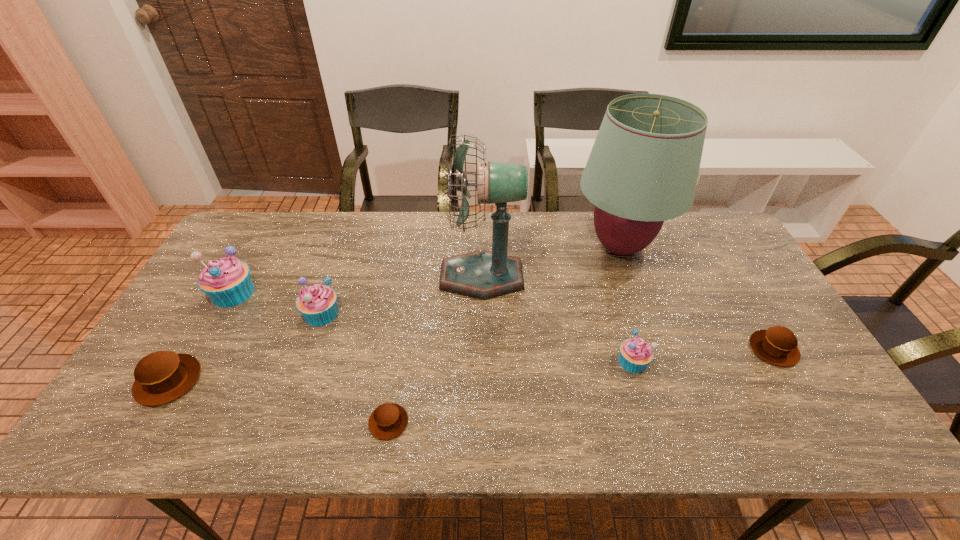
Find the location of `free spot at the right edge of the desktop`. free spot at the right edge of the desktop is located at coordinates (752, 351).

Locate an element on the screen. Image resolution: width=960 pixels, height=540 pixels. vacant space at the far left corner of the desktop is located at coordinates (280, 231).

You are a GUI agent. You are given a task and a screenshot of the screen. Output one action in this format:
    pyautogui.click(x=<x>, y=<y>)
    Task: Click on the vacant space at the far right corner of the desktop
    This screenshot has height=540, width=960.
    Given the screenshot: What is the action you would take?
    pyautogui.click(x=681, y=225)

The height and width of the screenshot is (540, 960). I want to click on vacant space at the near right corner of the desktop, so click(832, 424).

I want to click on blank region between the tallest muffin and the second shortest muffin, so click(503, 321).

Locate an element on the screen. free spot between the biggest brown muffin and the rightmost object is located at coordinates (471, 365).

At what (x,y) coordinates should I click in order to perform the action: click on free space that is in between the fifth object from left to right and the blue lampshade. Please return your answer as a coordinate pair (x, y). This screenshot has width=960, height=540. Looking at the image, I should click on (551, 262).

You are a GUI agent. You are given a task and a screenshot of the screen. Output one action in this format:
    pyautogui.click(x=<x>, y=<y>)
    Task: Click on the vacant area between the second brown muffin from left to right and the second shortest object
    The width and height of the screenshot is (960, 540).
    Given the screenshot: What is the action you would take?
    pyautogui.click(x=581, y=386)

I want to click on free spot between the third tallest object and the fifth shortest object, so click(x=277, y=303).

At what (x,y) coordinates should I click in order to perform the action: click on empty location between the fan and the second shortest muffin. Please return your answer as a coordinate pair (x, y). This screenshot has height=540, width=960. Looking at the image, I should click on (628, 313).